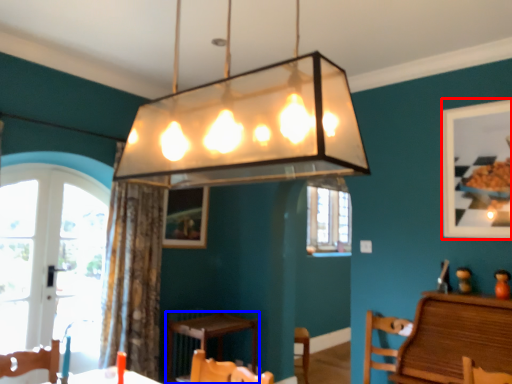
Question: Which of the following is the farthest to the observer, picture frame (highlighted by a red box) or table (highlighted by a blue box)?

Choices:
 (A) picture frame
 (B) table

Answer: (B)